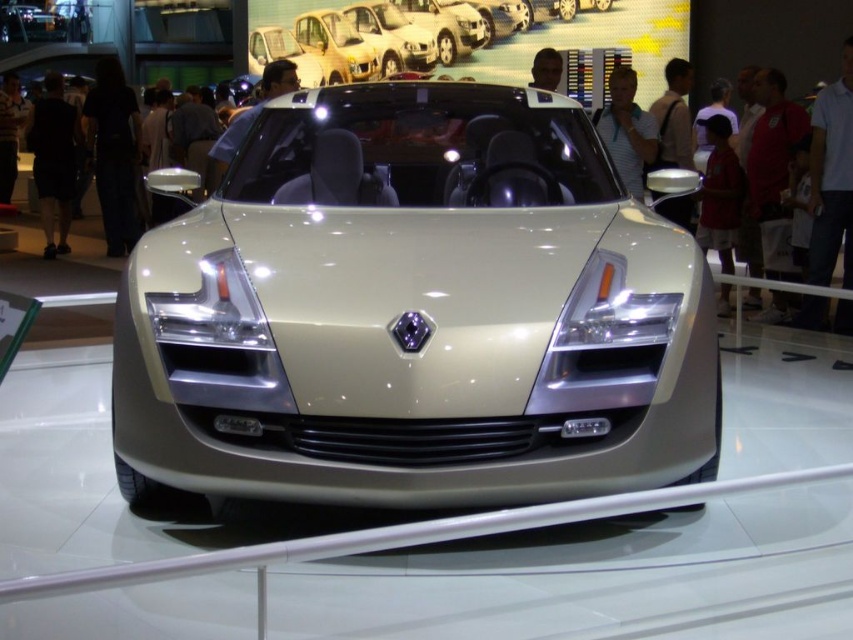
You are at an auto show and see the metallic silver car at center and the satin silver car at upper center. Which one is bigger in size?

The metallic silver car at center is larger in size than the satin silver car at upper center.

You are at an auto show and notice two cars displayed in front of you. The metallic silver car at center and the satin silver car at upper center. Which car is positioned higher in the image?

The metallic silver car at center is taller than the satin silver car at upper center, so the metallic silver car at center is positioned higher in the image.